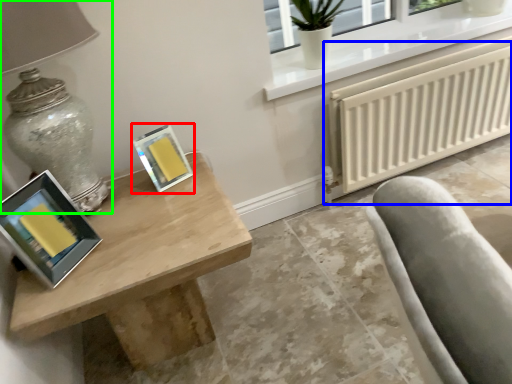
Question: Which object is the closest to the picture frame (highlighted by a red box)? Choose among these: radiator (highlighted by a blue box) or table lamp (highlighted by a green box).

Choices:
 (A) radiator
 (B) table lamp

Answer: (B)